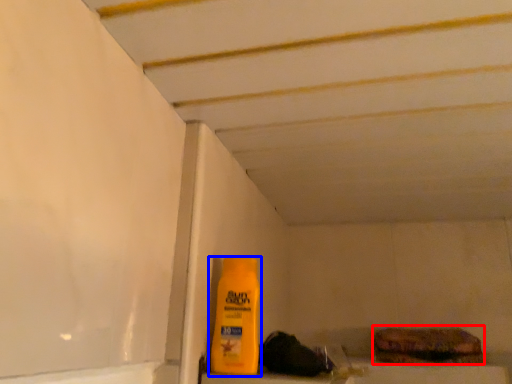
Question: Which of the following is the closest to the observer, food (highlighted by a red box) or bottle (highlighted by a blue box)?

Choices:
 (A) food
 (B) bottle

Answer: (B)